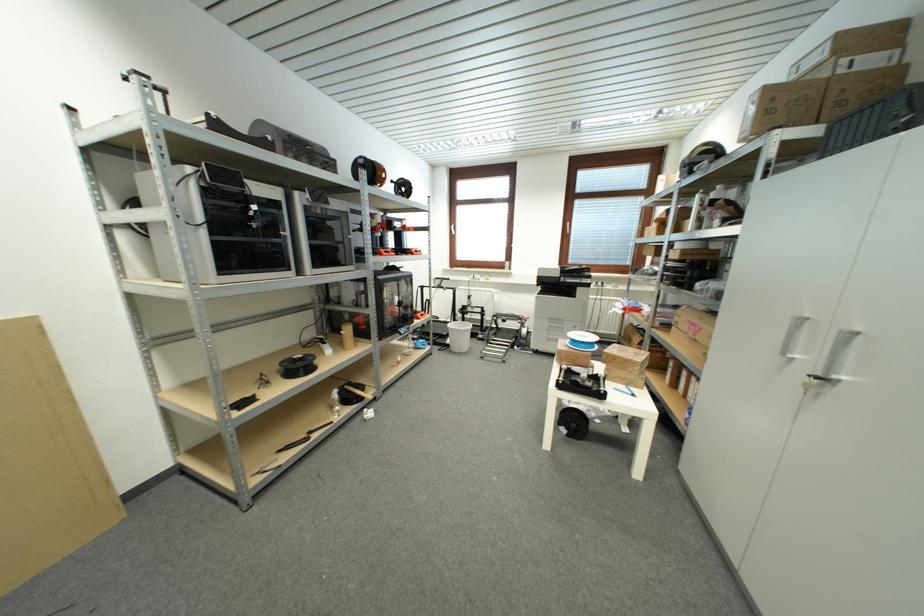
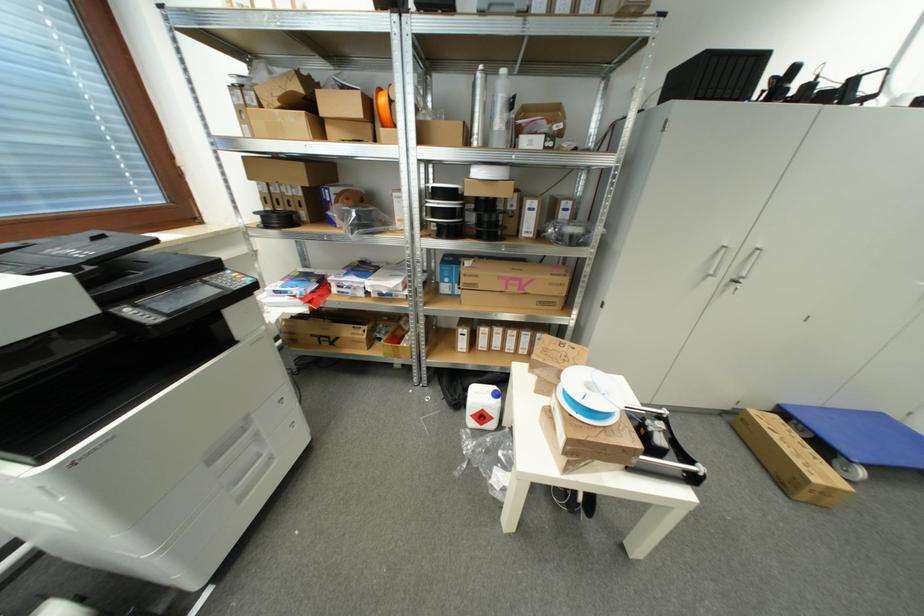
Where in the second image is the point corresponding to point (696, 281) from the first image?

(493, 225)